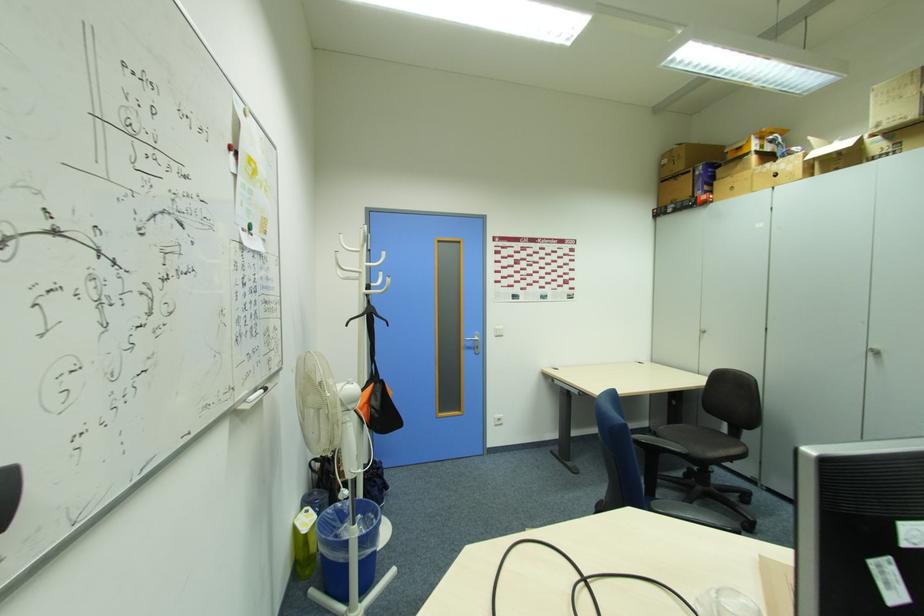
The height and width of the screenshot is (616, 924). What do you see at coordinates (698, 439) in the screenshot? I see `the chair sitting surface` at bounding box center [698, 439].